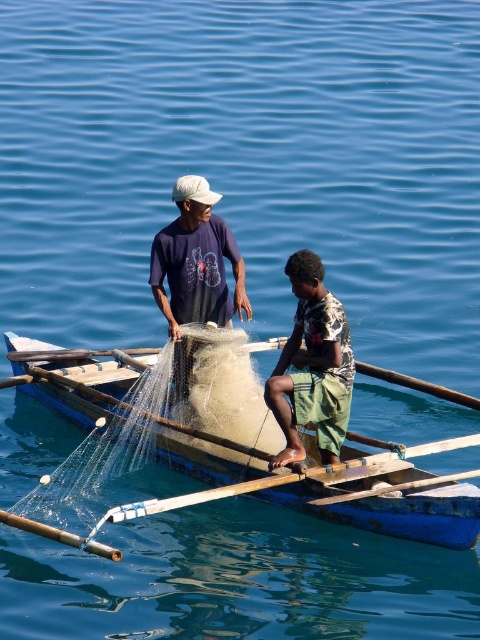
Question: Which of these objects is positioned farthest from the wooden smooth paddle at center?

Choices:
 (A) wooden boat at center
 (B) matte blue shirt at center

Answer: (B)

Question: Does wooden boat at center appear over printed fabric shirt at center?

Choices:
 (A) yes
 (B) no

Answer: (B)

Question: Is wooden boat at center wider than printed fabric shirt at center?

Choices:
 (A) yes
 (B) no

Answer: (A)

Question: Which point is closer to the camera taking this photo?

Choices:
 (A) (396, 490)
 (B) (406, 470)

Answer: (A)

Question: Can you confirm if matte blue shirt at center is bigger than wooden smooth paddle at center?

Choices:
 (A) yes
 (B) no

Answer: (A)

Question: Which object is the farthest from the wooden boat at center?

Choices:
 (A) wooden smooth paddle at center
 (B) printed fabric shirt at center

Answer: (A)